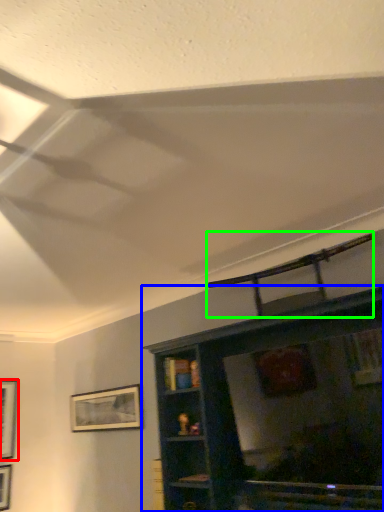
Question: Which object is the farthest from picture frame (highlighted by a red box)? Choose among these: shelf (highlighted by a blue box) or swivel chair (highlighted by a green box).

Choices:
 (A) shelf
 (B) swivel chair

Answer: (B)